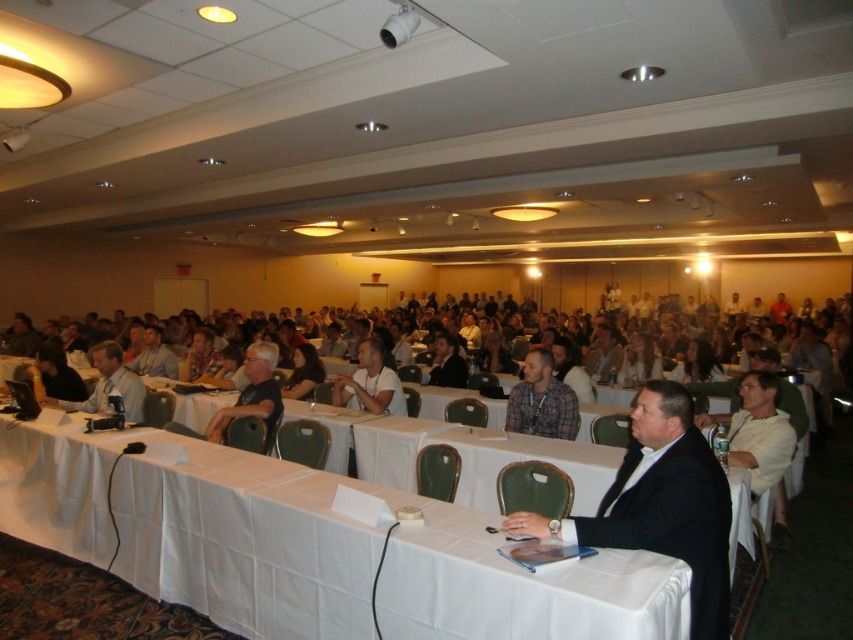
Question: Which point is farther to the camera?

Choices:
 (A) matte black shirt at lower left
 (B) plaid fabric shirt at center

Answer: (A)

Question: Can you confirm if white cloth at center is bigger than plaid fabric shirt at center?

Choices:
 (A) no
 (B) yes

Answer: (B)

Question: Which of the following is the farthest from the observer?

Choices:
 (A) white cloth at center
 (B) plaid fabric shirt at center
 (C) matte black shirt at lower left
 (D) black suit at center

Answer: (C)

Question: Is black suit at center to the left of plaid fabric shirt at center from the viewer's perspective?

Choices:
 (A) no
 (B) yes

Answer: (A)

Question: Which point is farther to the camera?

Choices:
 (A) matte black shirt at center
 (B) plaid fabric shirt at center
 (C) white cloth at center
 (D) matte black shirt at lower left

Answer: (D)

Question: Can you confirm if white cloth at center is positioned to the left of matte black shirt at center?

Choices:
 (A) yes
 (B) no

Answer: (B)